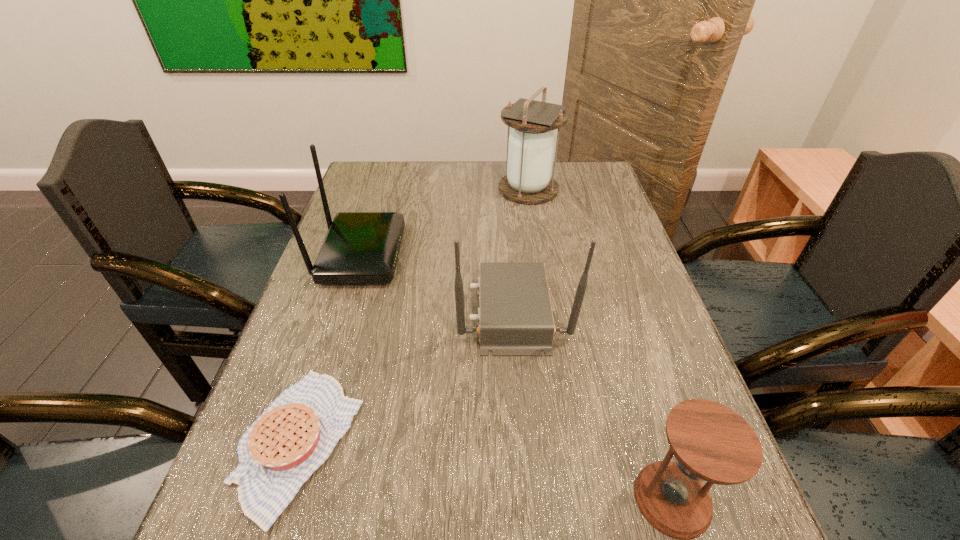
Identify the location of object positioned at the far edge. (530, 147).

I want to click on object that is at the near edge, so click(293, 437).

Locate an element on the screen. The image size is (960, 540). router at the left edge is located at coordinates (360, 247).

Find the location of a particular element. The height and width of the screenshot is (540, 960). pie at the left edge is located at coordinates (293, 437).

What are the coordinates of `object at the near left corner` in the screenshot? It's located at (293, 437).

Locate an element on the screen. Image resolution: width=960 pixels, height=540 pixels. free space at the far edge is located at coordinates (447, 170).

In the image, there is a desktop. Where is `vacant space at the left edge`? vacant space at the left edge is located at coordinates [x=335, y=319].

The image size is (960, 540). Identify the location of free location at the right edge. (618, 322).

At what (x,y) coordinates should I click in order to perform the action: click on free space at the far left corner. Please return your answer as a coordinate pair (x, y). The height and width of the screenshot is (540, 960). Looking at the image, I should click on (370, 186).

The height and width of the screenshot is (540, 960). What are the coordinates of `vacant space at the near left corner of the desktop` in the screenshot? It's located at (286, 532).